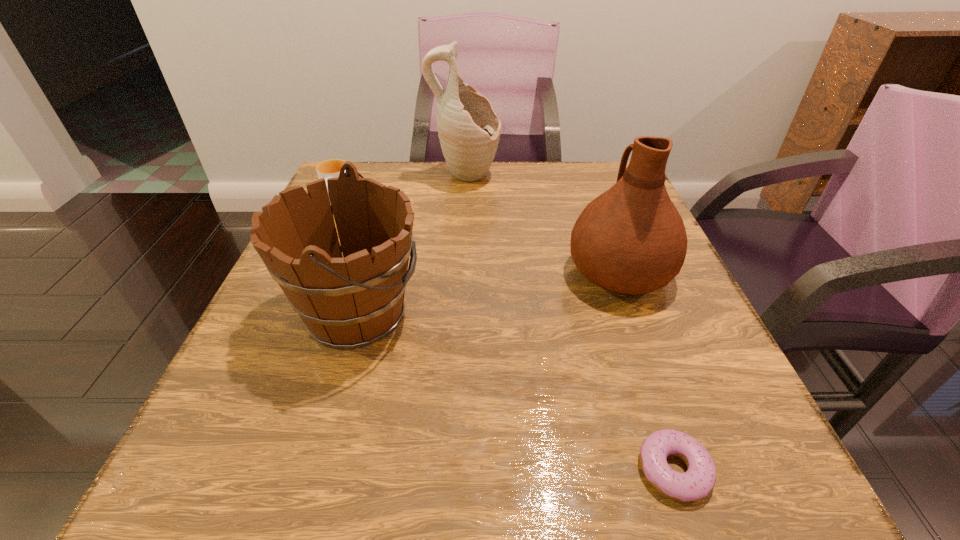
The image size is (960, 540). I want to click on free location that satisfies the following two spatial constraints: 1. with the handle on the wine bucket; 2. on the right side of the nearest object, so click(312, 469).

Image resolution: width=960 pixels, height=540 pixels. Identify the location of blank space that satisfies the following two spatial constraints: 1. at the spout of the farthest object; 2. with the handle on the side of the fourth tallest object. (464, 205).

Find the location of a particular element. This screenshot has width=960, height=540. free location that satisfies the following two spatial constraints: 1. on the side of the right pitcher with the handle; 2. at the spout of the farthest object is located at coordinates (585, 177).

Where is `vacant point that satisfies the following two spatial constraints: 1. at the spout of the farther pitcher; 2. with the handle on the side of the second shortest object`? Image resolution: width=960 pixels, height=540 pixels. vacant point that satisfies the following two spatial constraints: 1. at the spout of the farther pitcher; 2. with the handle on the side of the second shortest object is located at coordinates [464, 205].

The height and width of the screenshot is (540, 960). In order to click on vacant space that satisfies the following two spatial constraints: 1. with the handle on the side of the fourth tallest object; 2. on the right side of the nearest object in this screenshot , I will do `click(219, 469)`.

Image resolution: width=960 pixels, height=540 pixels. Find the location of `vacant space that satisfies the following two spatial constraints: 1. at the spout of the farthest object; 2. with the handle on the side of the fourth tallest object`. vacant space that satisfies the following two spatial constraints: 1. at the spout of the farthest object; 2. with the handle on the side of the fourth tallest object is located at coordinates coord(464,205).